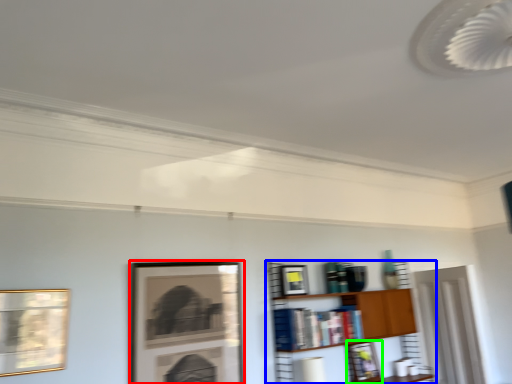
Question: Considering the real-world distances, which object is farthest from picture frame (highlighted by a red box)? shelf (highlighted by a blue box) or picture frame (highlighted by a green box)?

Choices:
 (A) shelf
 (B) picture frame

Answer: (B)